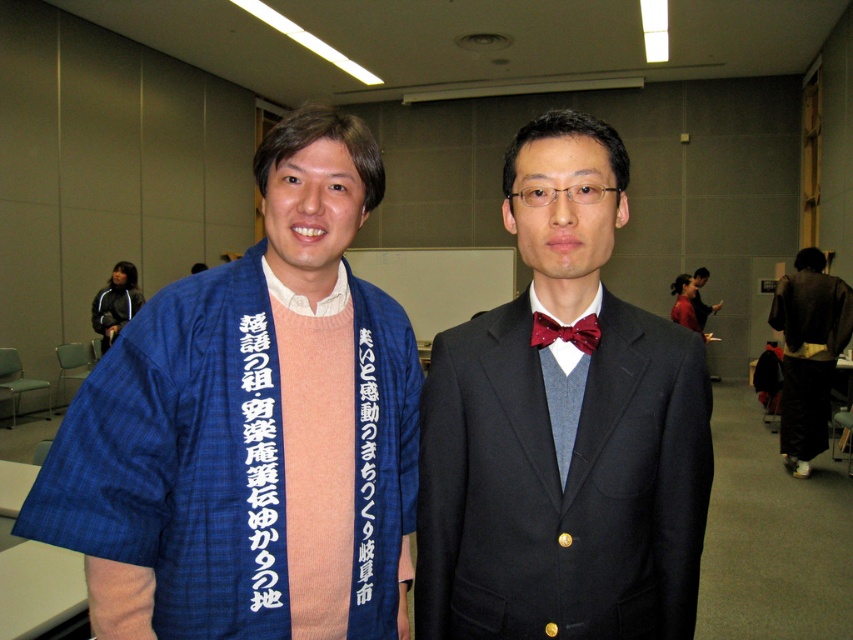
Between point (94, 577) and point (701, 316), which one is positioned in front?

Point (94, 577)

Which is in front, point (312, 636) or point (712, 312)?

Point (312, 636) is in front.

Where is `blue plaid kimono at left`? Image resolution: width=853 pixels, height=640 pixels. blue plaid kimono at left is located at coordinates (251, 428).

Between blue plaid kimono at left and brown kimono at right, which one has less height?

Standing shorter between the two is blue plaid kimono at left.

Is point (204, 428) closer to viewer compared to point (811, 289)?

Yes, it is in front of point (811, 289).

Where is `blue plaid kimono at left`? blue plaid kimono at left is located at coordinates (251, 428).

Does brown kimono at right appear on the left side of shiny red bow tie at center?

Incorrect, brown kimono at right is not on the left side of shiny red bow tie at center.

Who is positioned more to the left, brown kimono at right or shiny red bow tie at center?

shiny red bow tie at center is more to the left.

Is point (828, 394) positioned in front of point (531, 339)?

No, (828, 394) is behind (531, 339).

Find the location of a particular element. Image resolution: width=853 pixels, height=640 pixels. brown kimono at right is located at coordinates (808, 353).